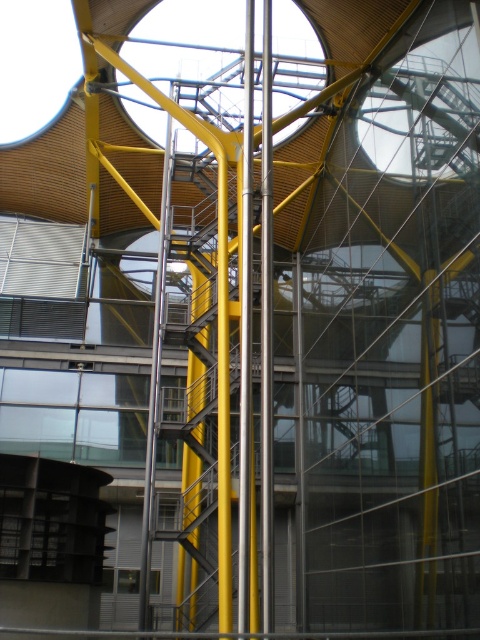
Can you confirm if polished metal pole at center is wider than metallic yellow pole at center?

In fact, polished metal pole at center might be narrower than metallic yellow pole at center.

Which is in front, point (247, 72) or point (167, 164)?

Positioned in front is point (247, 72).

Identify the location of polished metal pole at center. (247, 358).